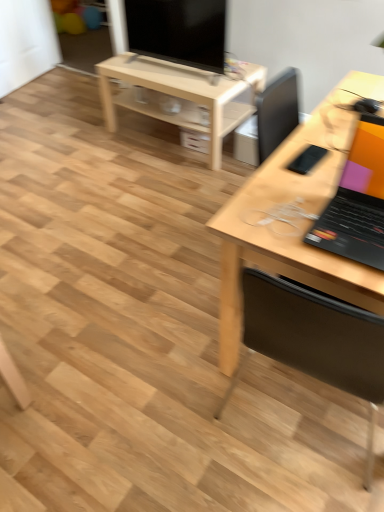
I want to click on blank area to the left of black matte laptop at right, so click(x=281, y=215).